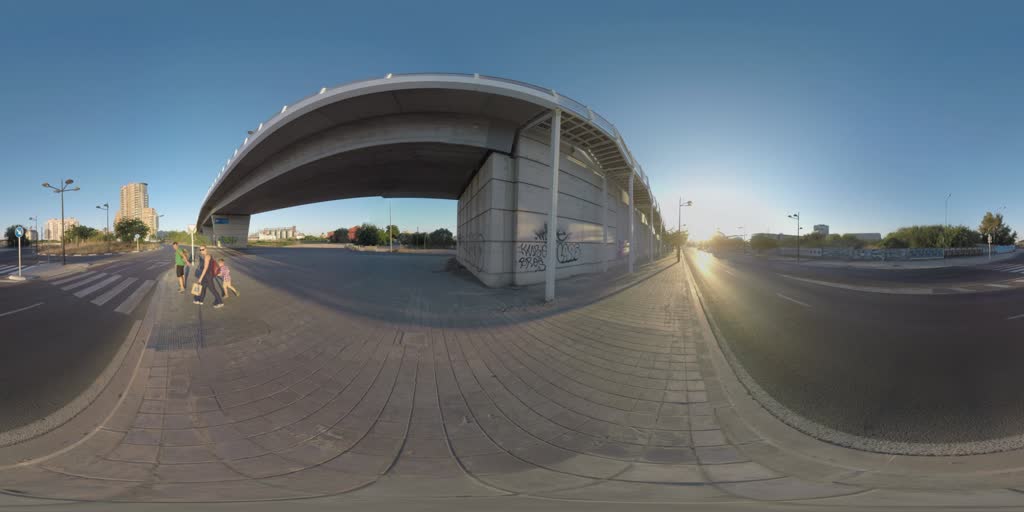
This screenshot has height=512, width=1024. Find the location of `lamp`. lamp is located at coordinates (74, 211).